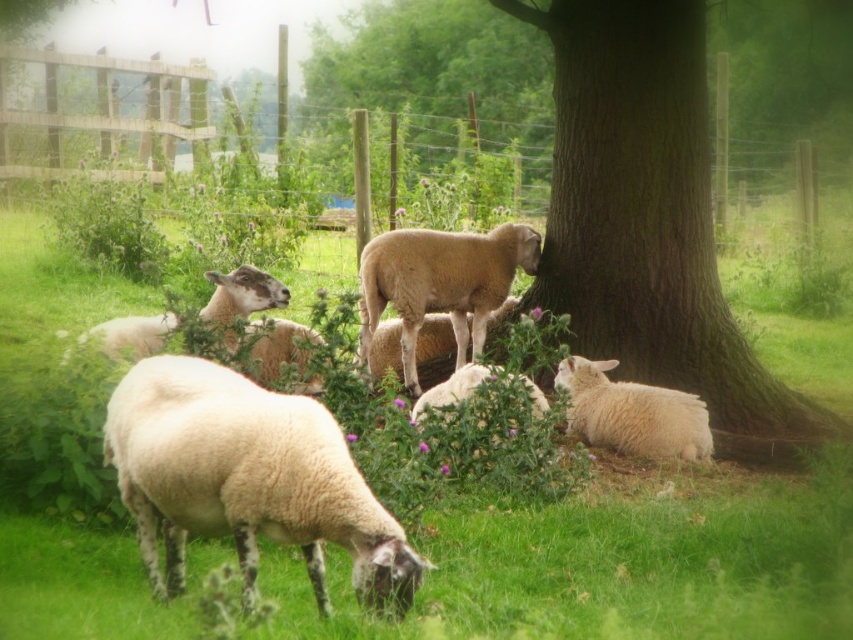
Question: Does wire mesh fence at center have a larger size compared to white woolly sheep at lower right?

Choices:
 (A) no
 (B) yes

Answer: (B)

Question: Is fuzzy white sheep at center below white woolly sheep at lower right?

Choices:
 (A) yes
 (B) no

Answer: (B)

Question: Which point is farther from the camera taking this photo?

Choices:
 (A) (573, 140)
 (B) (143, 541)
 (C) (695, 413)
 (D) (477, 376)

Answer: (A)

Question: Among these points, which one is farthest from the camera?

Choices:
 (A) (648, 484)
 (B) (242, 502)
 (C) (604, 396)

Answer: (C)

Question: Which point appears farthest from the camera in this image?

Choices:
 (A) (166, 566)
 (B) (633, 577)
 (C) (694, 129)

Answer: (C)

Question: Can you confirm if green rough bark tree at center is positioned above wire mesh fence at center?

Choices:
 (A) no
 (B) yes

Answer: (A)